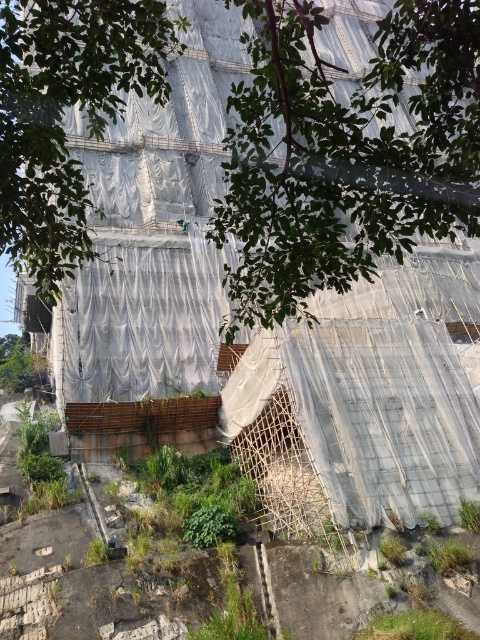
Question: Is green leafy tree at upper center positioned in front of green leafy tree at center?

Choices:
 (A) yes
 (B) no

Answer: (A)

Question: Which point appears farthest from the camera in this image?

Choices:
 (A) (44, 259)
 (B) (104, 44)

Answer: (A)

Question: Does green leafy tree at upper center appear over green leafy tree at center?

Choices:
 (A) yes
 (B) no

Answer: (A)

Question: Which point is closer to the camera?

Choices:
 (A) (94, 56)
 (B) (34, 179)

Answer: (A)

Question: Is green leafy tree at upper center to the left of green leafy tree at center from the viewer's perspective?

Choices:
 (A) no
 (B) yes

Answer: (A)

Question: Which object is farther from the camera taking this photo?

Choices:
 (A) green leafy tree at upper center
 (B) green leafy tree at center

Answer: (B)